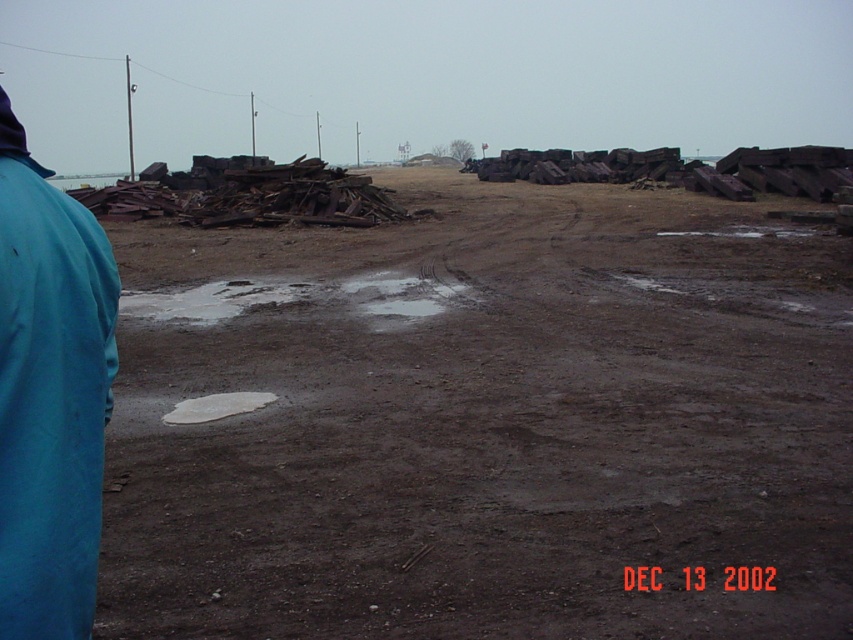
You are standing at the point marked by point (485,420) in the image, which is in the brown dirt field at center. You want to walk towards the large piles of scrap metal or debris in the midground. Which direction should you head?

The point (485,420) is located at the brown dirt field at center. Since the large piles of scrap metal or debris are in the midground, you should head towards the midground direction from the center point to reach them.

You are a delivery driver who needs to avoid the white matte puddle at center while approaching the blue fabric jacket at left. Which direction should you turn to go around the puddle and reach the jacket?

Since the blue fabric jacket at left is to the right of the white matte puddle at center, you should turn right to go around the puddle and head towards the jacket.